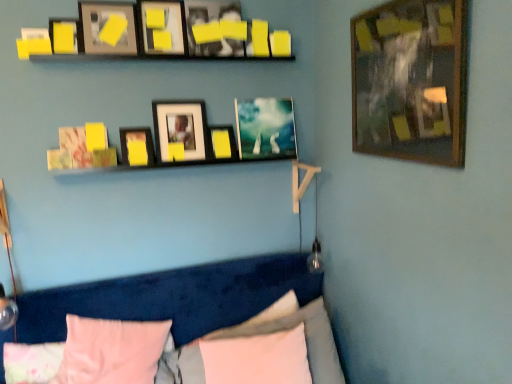
Question: Does matte black picture frame at upper center, the 7th picture frame positioned from the right, appear on the right side of yellow matte picture frame at upper center, placed as the 6th picture frame when sorted from right to left?

Choices:
 (A) no
 (B) yes

Answer: (A)

Question: From a real-world perspective, is matte black picture frame at upper center, the 7th picture frame positioned from the right, physically above yellow matte picture frame at upper center, acting as the fifth picture frame starting from the left?

Choices:
 (A) no
 (B) yes

Answer: (A)

Question: From the image's perspective, is matte black picture frame at upper center, the 4th picture frame in the left-to-right sequence, over yellow matte picture frame at upper center, placed as the 6th picture frame when sorted from right to left?

Choices:
 (A) no
 (B) yes

Answer: (A)

Question: Can you confirm if matte black picture frame at upper center, the 4th picture frame in the left-to-right sequence, is bigger than yellow matte picture frame at upper center, placed as the 6th picture frame when sorted from right to left?

Choices:
 (A) no
 (B) yes

Answer: (A)

Question: Is matte black picture frame at upper center, the 7th picture frame positioned from the right, touching yellow matte picture frame at upper center, acting as the fifth picture frame starting from the left?

Choices:
 (A) no
 (B) yes

Answer: (A)

Question: Is point (214, 147) closer or farther from the camera than point (166, 349)?

Choices:
 (A) closer
 (B) farther

Answer: (B)

Question: Based on their positions, is yellow matte picture frame at upper center, which ranks as the third picture frame in right-to-left order, located to the left or right of pink fabric pillow at lower center, which is the third pillow in left-to-right order?

Choices:
 (A) right
 (B) left

Answer: (A)

Question: In terms of height, does yellow matte picture frame at upper center, which ranks as the third picture frame in right-to-left order, look taller or shorter compared to pink fabric pillow at lower center, which is the third pillow in left-to-right order?

Choices:
 (A) tall
 (B) short

Answer: (B)

Question: From a real-world perspective, relative to pink fabric pillow at lower center, which is the third pillow in left-to-right order, is yellow matte picture frame at upper center, which ranks as the third picture frame in right-to-left order, vertically above or below?

Choices:
 (A) below
 (B) above

Answer: (B)

Question: From the image's perspective, is white soft pillow at lower center, the 4th pillow viewed from the left, located above or below yellow matte picture frame at upper center, placed as the 6th picture frame when sorted from right to left?

Choices:
 (A) below
 (B) above

Answer: (A)

Question: Considering the relative positions of white soft pillow at lower center, positioned as the second pillow in right-to-left order, and yellow matte picture frame at upper center, placed as the 6th picture frame when sorted from right to left, in the image provided, is white soft pillow at lower center, positioned as the second pillow in right-to-left order, to the left or to the right of yellow matte picture frame at upper center, placed as the 6th picture frame when sorted from right to left,?

Choices:
 (A) right
 (B) left

Answer: (A)

Question: Considering the positions of white soft pillow at lower center, the 4th pillow viewed from the left, and yellow matte picture frame at upper center, acting as the fifth picture frame starting from the left, in the image, is white soft pillow at lower center, the 4th pillow viewed from the left, wider or thinner than yellow matte picture frame at upper center, acting as the fifth picture frame starting from the left,?

Choices:
 (A) thin
 (B) wide

Answer: (B)

Question: In the image, is white soft pillow at lower center, the 4th pillow viewed from the left, positioned in front of or behind yellow matte picture frame at upper center, acting as the fifth picture frame starting from the left?

Choices:
 (A) front
 (B) behind

Answer: (A)

Question: Does point (166, 13) appear closer or farther from the camera than point (231, 140)?

Choices:
 (A) closer
 (B) farther

Answer: (A)

Question: Considering the positions of yellow matte picture frame at upper center, acting as the fifth picture frame starting from the left, and yellow matte picture frame at upper center, which ranks as the third picture frame in right-to-left order, in the image, is yellow matte picture frame at upper center, acting as the fifth picture frame starting from the left, bigger or smaller than yellow matte picture frame at upper center, which ranks as the third picture frame in right-to-left order,?

Choices:
 (A) small
 (B) big

Answer: (B)